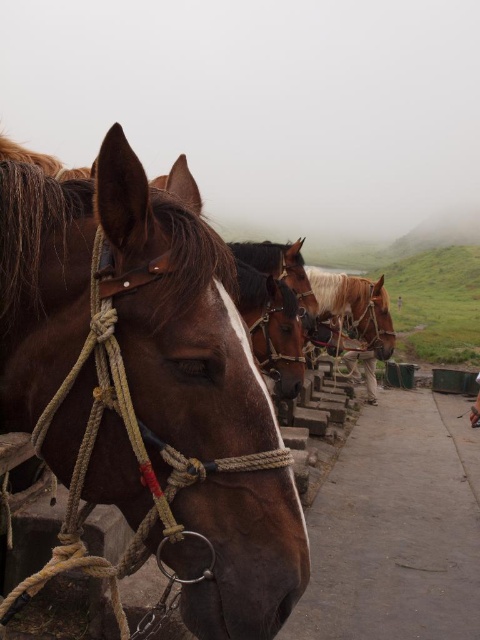
Question: Can you confirm if brown glossy horse at center is positioned to the left of light brown leather shoes at lower right?

Choices:
 (A) no
 (B) yes

Answer: (B)

Question: Which object appears farthest from the camera in this image?

Choices:
 (A) brown leather rope at left
 (B) brown leather horse at center
 (C) light brown leather horse at center
 (D) light brown leather shoes at lower right

Answer: (C)

Question: Is light brown leather horse at center further to the viewer compared to light brown leather shoes at lower right?

Choices:
 (A) no
 (B) yes

Answer: (B)

Question: Is brown leather rope at left bigger than brown glossy horse at center?

Choices:
 (A) yes
 (B) no

Answer: (A)

Question: Among these points, which one is farthest from the camera?

Choices:
 (A) (277, 317)
 (B) (276, 256)
 (C) (159, 292)

Answer: (B)

Question: Which object is closer to the camera taking this photo?

Choices:
 (A) brown glossy horse at center
 (B) brown leather horse at center
 (C) light brown leather shoes at lower right

Answer: (A)